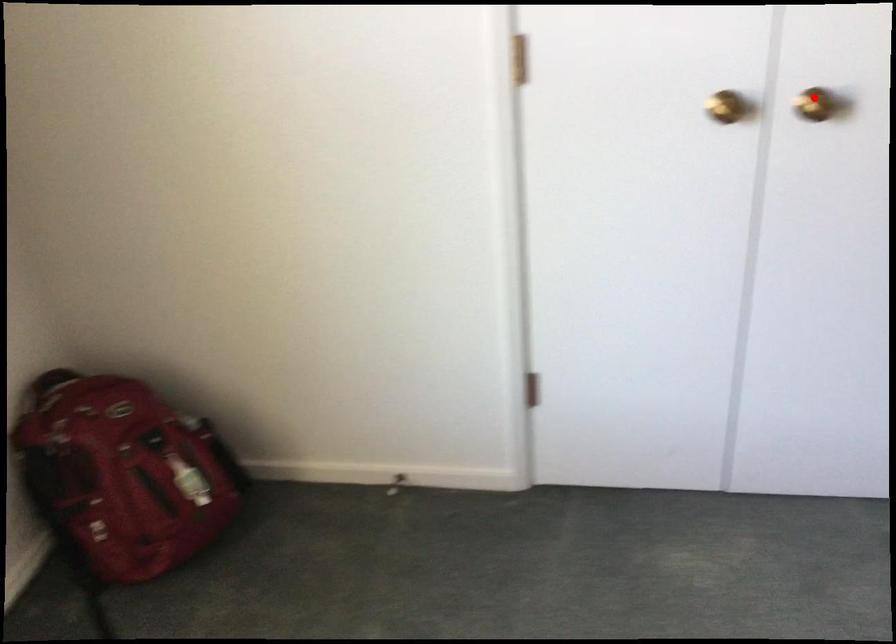
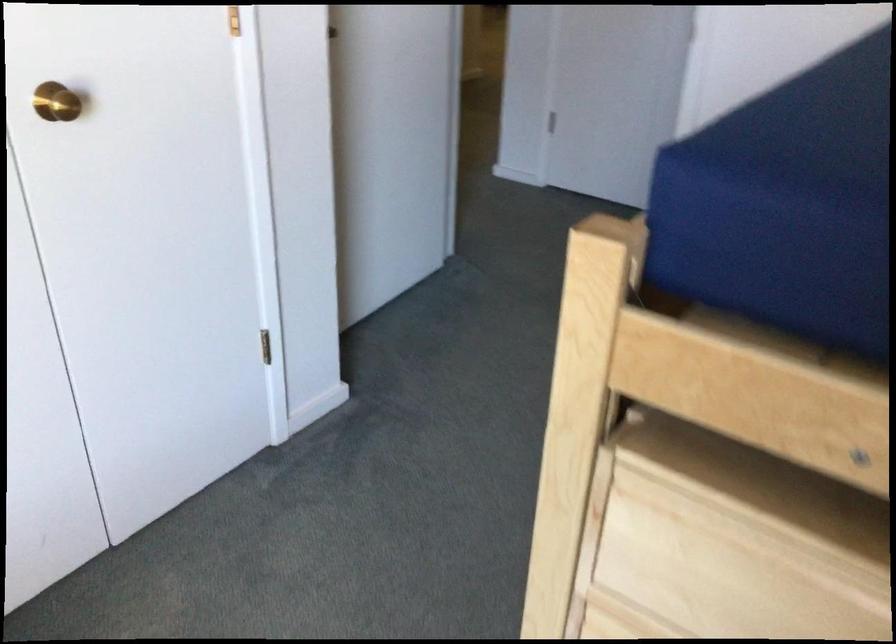
In the second image, find the point that corresponds to the highlighted location in the first image.

(56, 102)